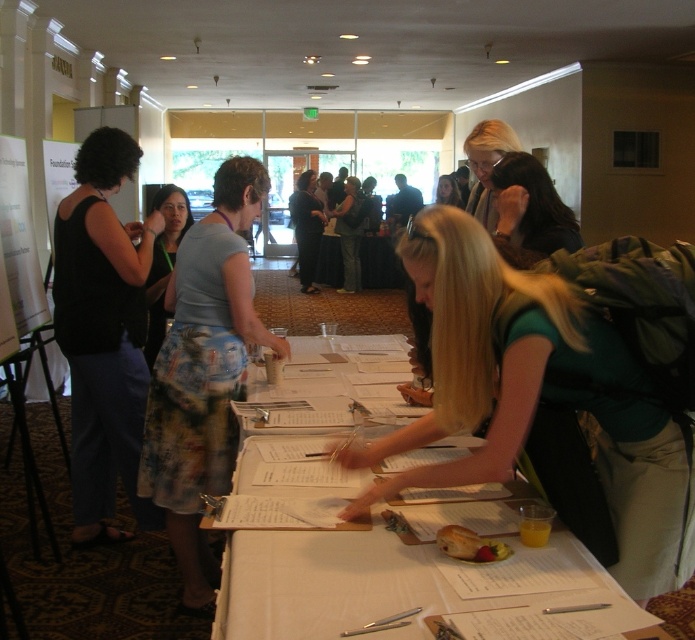
You are a photographer standing at the entrance of the room. You want to take a photo of the matte gray shirt at center and the golden brown bread at table center such that both are visible in the frame. Based on their positions, which object should be placed on the left side of the photo frame?

The matte gray shirt at center is positioned on the left side of golden brown bread at table center, so to include both in the frame, the matte gray shirt at center should be on the left side of the photo frame.

You are a photographer standing at the back of the room. You want to take a photo of the black fabric tank top at left and the dark brown hair at upper right so that both are clearly visible in the frame. Given that your camera has a maximum focus range of 5 feet, will you be able to capture both subjects in focus?

The black fabric tank top at left and dark brown hair at upper right are 5.66 feet apart. Since the distance between them exceeds the camera maximum focus range of 5 feet, the photographer may not be able to capture both subjects in focus.

You are organizing a meeting and need to place a large folder on the table. The folder is wider than the golden brown bread at table center. Can you place it where the matte gray shirt at center is currently located?

The matte gray shirt at center is wider than the golden brown bread at table center, so the large folder can be placed there as it has enough space.